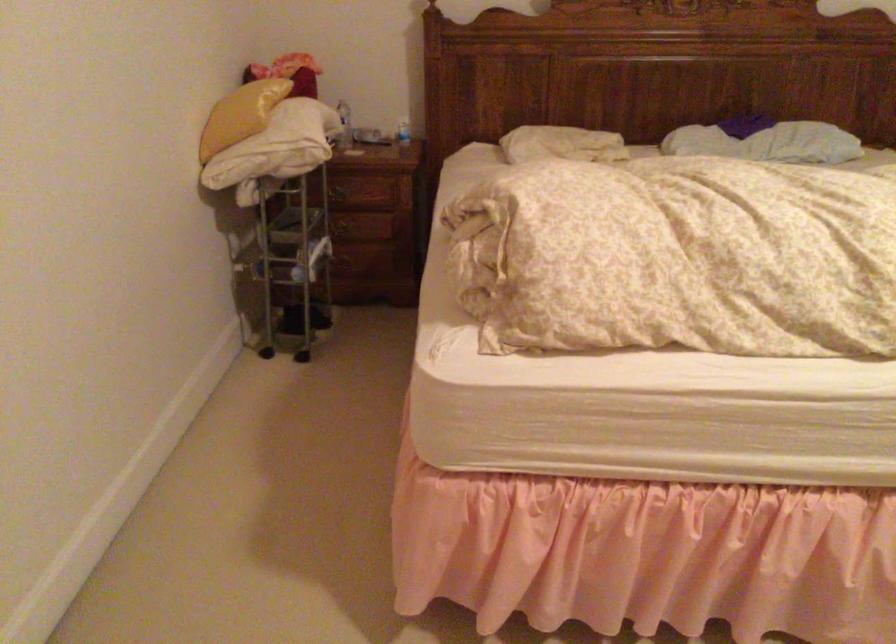
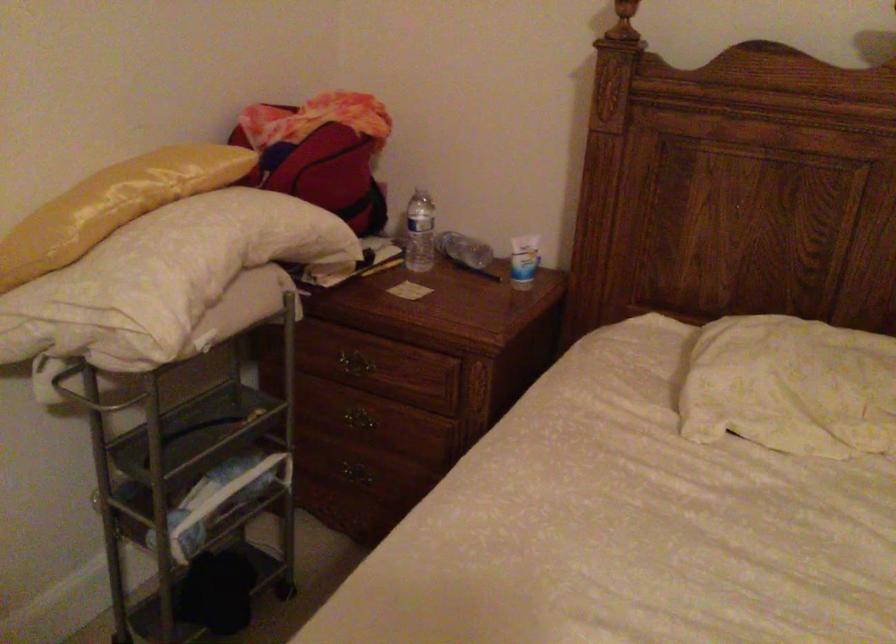
The point at (314,128) is marked in the first image. Where is the corresponding point in the second image?

(164, 278)